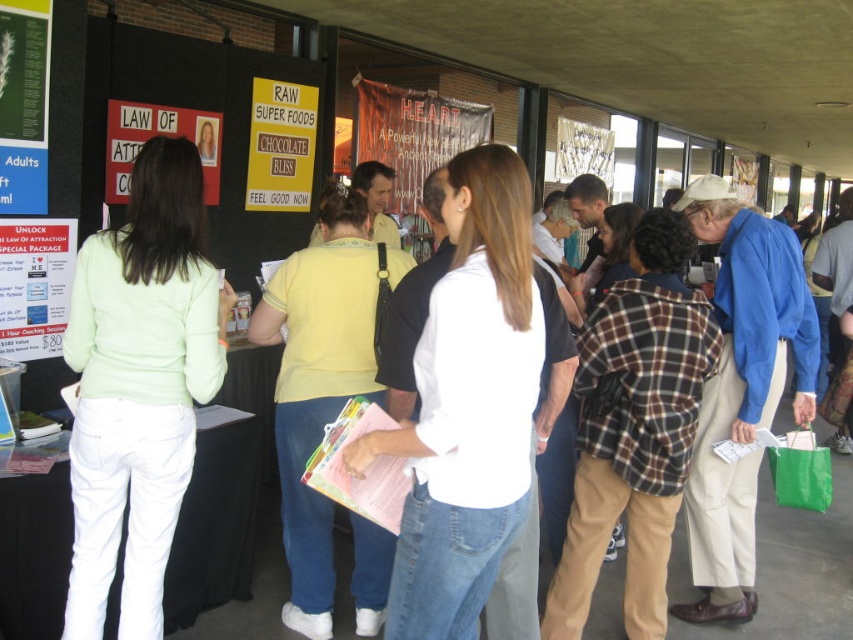
Question: Which point appears closest to the camera in this image?

Choices:
 (A) (387, 435)
 (B) (125, 154)
 (C) (73, 248)

Answer: (A)

Question: Can you confirm if matte red poster at upper left is smaller than white paper at upper center?

Choices:
 (A) no
 (B) yes

Answer: (B)

Question: Does light green fabric shirt at left appear under white cotton shirt at center?

Choices:
 (A) no
 (B) yes

Answer: (B)

Question: Among these objects, which one is nearest to the camera?

Choices:
 (A) white paper at upper center
 (B) matte red poster at upper left

Answer: (B)

Question: Is green matte poster at upper left closer to the viewer compared to matte red poster at upper left?

Choices:
 (A) no
 (B) yes

Answer: (B)

Question: Among these points, which one is nearest to the camera?

Choices:
 (A) (218, 129)
 (B) (15, 337)
 (C) (9, 74)

Answer: (C)